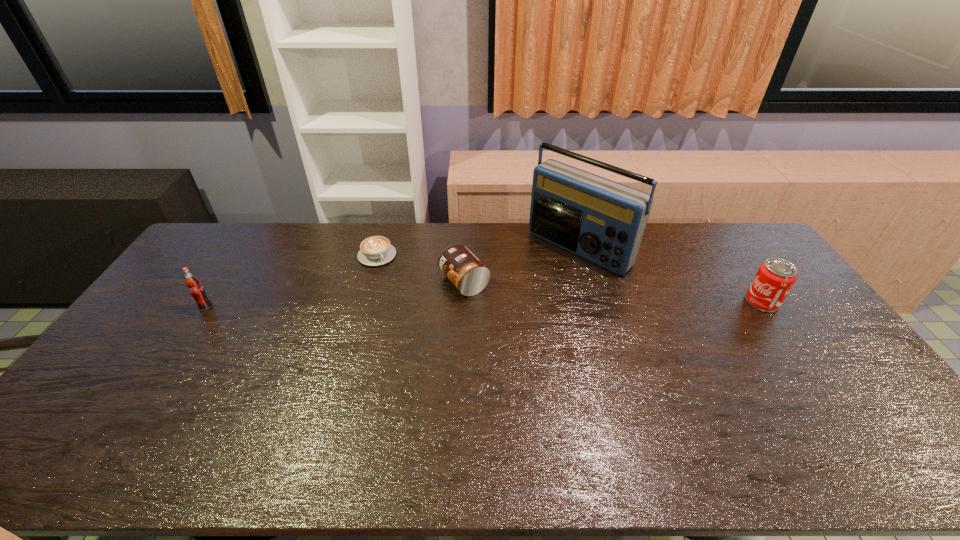
Locate an element on the screen. radio receiver present at the far edge is located at coordinates (603, 221).

Where is `cappuccino situated at the far edge`? The width and height of the screenshot is (960, 540). cappuccino situated at the far edge is located at coordinates (377, 250).

Where is `object present at the left edge`? The width and height of the screenshot is (960, 540). object present at the left edge is located at coordinates (193, 284).

What are the coordinates of `object present at the right edge` in the screenshot? It's located at (775, 277).

The width and height of the screenshot is (960, 540). In the image, there is a desktop. Find the location of `vacant space at the far edge`. vacant space at the far edge is located at coordinates (507, 242).

Image resolution: width=960 pixels, height=540 pixels. What are the coordinates of `vacant region at the near edge of the desktop` in the screenshot? It's located at (354, 414).

The height and width of the screenshot is (540, 960). In the image, there is a desktop. Find the location of `vacant region at the left edge`. vacant region at the left edge is located at coordinates (156, 378).

In the image, there is a desktop. At what (x,y) coordinates should I click in order to perform the action: click on free region at the right edge. Please return your answer as a coordinate pair (x, y). The width and height of the screenshot is (960, 540). Looking at the image, I should click on coord(838,358).

Where is `vacant position at the far right corner of the desktop`? vacant position at the far right corner of the desktop is located at coordinates (743, 259).

Find the location of a particular element. This screenshot has height=540, width=960. free spot between the right can and the second object from right to left is located at coordinates (670, 275).